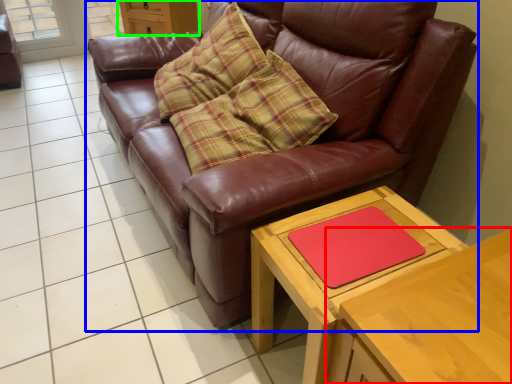
Question: Which object is the closest to the table (highlighted by a red box)? Choose among these: studio couch (highlighted by a blue box) or dresser (highlighted by a green box).

Choices:
 (A) studio couch
 (B) dresser

Answer: (A)